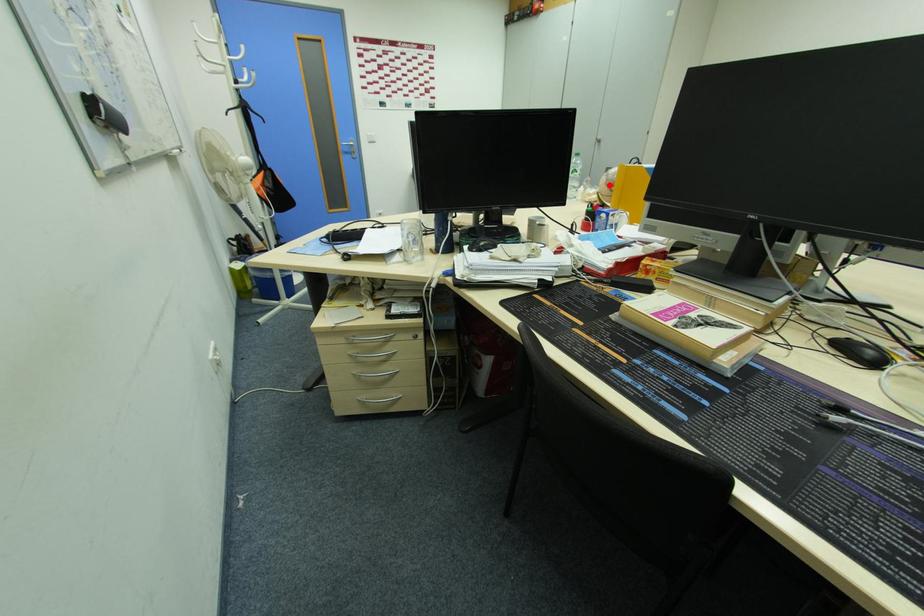
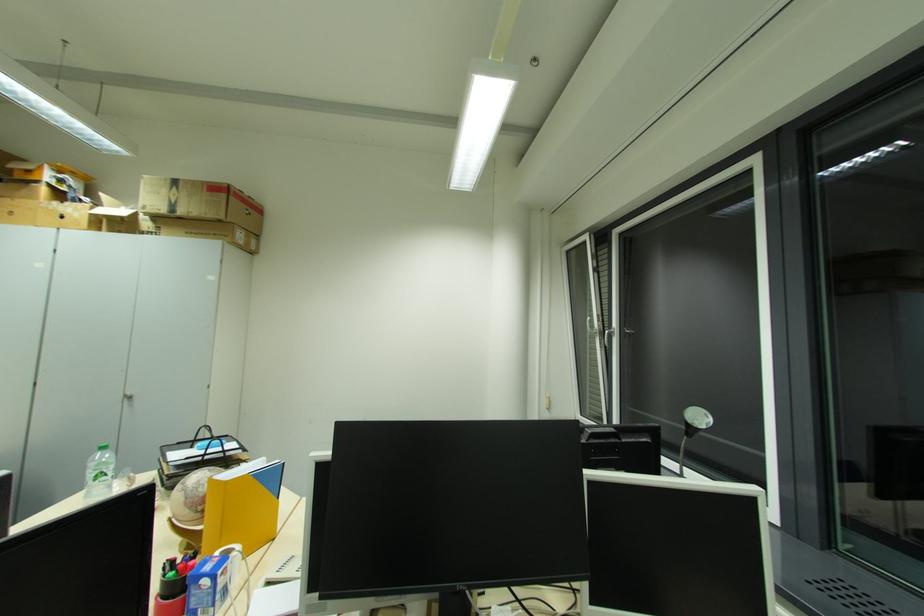
Question: I am providing you with two images of the same scene from different viewpoints. Image1 has a red point marked. In image2, the corresponding 3D location appears at what relative position? Reply with the corresponding letter.

Choices:
 (A) Closer
 (B) Farther

Answer: (B)